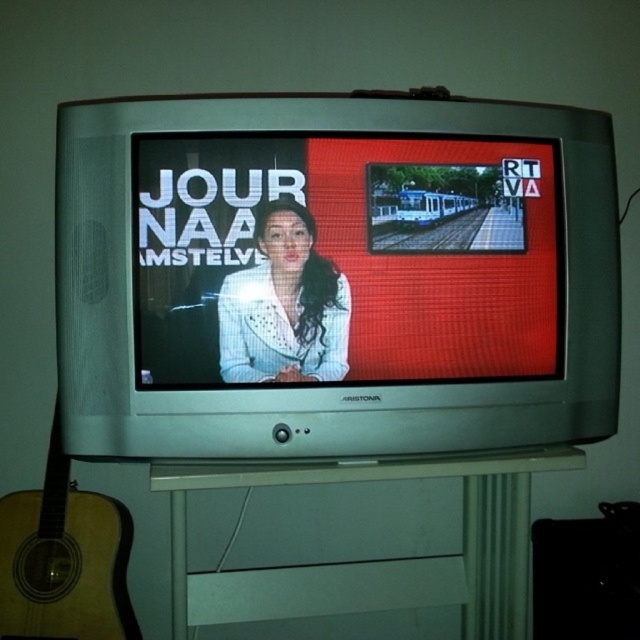
Who is positioned more to the right, matte white jacket at center or acoustic wood guitar at left?

matte white jacket at center is more to the right.

Is matte white jacket at center in front of acoustic wood guitar at left?

Yes, matte white jacket at center is in front of acoustic wood guitar at left.

Between point (204, 220) and point (22, 588), which one is positioned behind?

Point (22, 588)

Where is `matte white jacket at center`? matte white jacket at center is located at coordinates (346, 259).

Can you confirm if matte white jacket at center is wider than white textured blazer at center?

Yes, matte white jacket at center is wider than white textured blazer at center.

Is matte white jacket at center below white textured blazer at center?

Incorrect, matte white jacket at center is not positioned below white textured blazer at center.

This screenshot has width=640, height=640. I want to click on matte white jacket at center, so click(346, 259).

Can you confirm if acoustic wood guitar at left is shorter than white textured blazer at center?

No, acoustic wood guitar at left is not shorter than white textured blazer at center.

Who is positioned more to the right, acoustic wood guitar at left or white textured blazer at center?

From the viewer's perspective, white textured blazer at center appears more on the right side.

Does point (12, 612) lie in front of point (291, 252)?

That is False.

At what (x,y) coordinates should I click in order to perform the action: click on acoustic wood guitar at left. Please return your answer as a coordinate pair (x, y). Looking at the image, I should click on (64, 557).